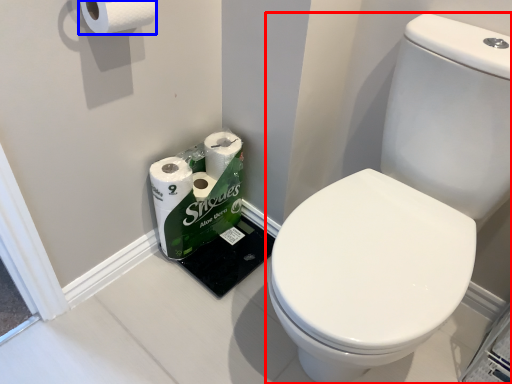
Question: Which of the following is the farthest to the observer, toilet (highlighted by a red box) or toilet paper (highlighted by a blue box)?

Choices:
 (A) toilet
 (B) toilet paper

Answer: (B)